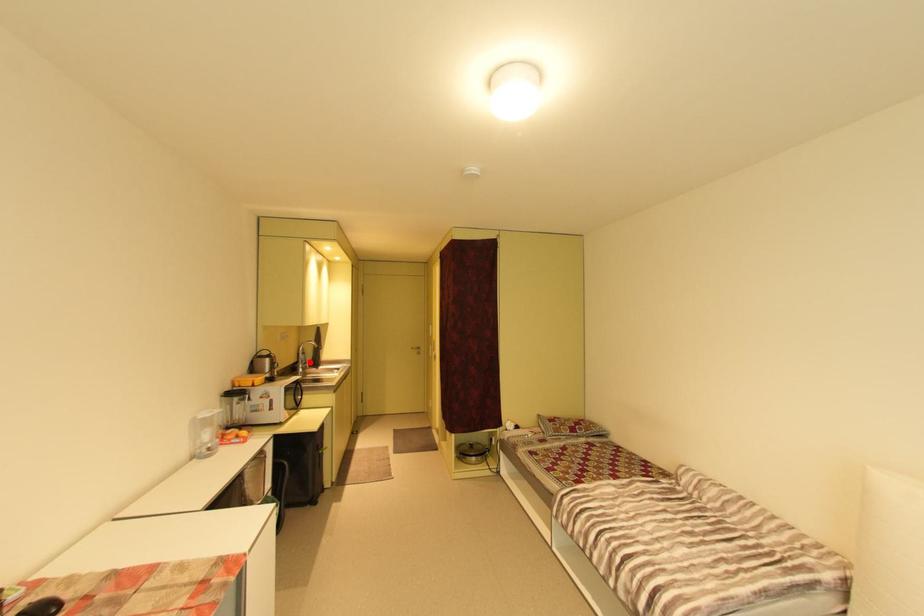
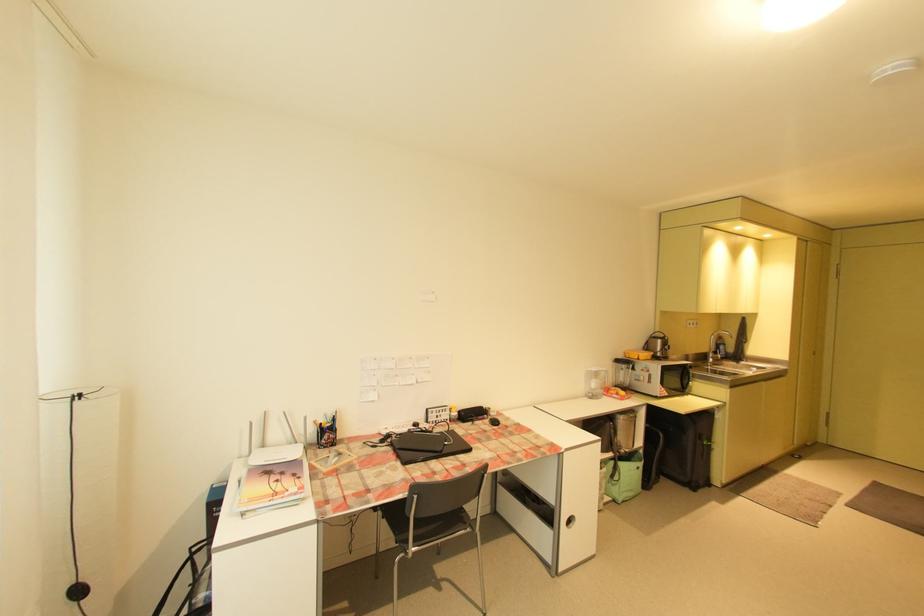
Find the pixel in the second image that matches the highlighted location in the first image.

(722, 353)